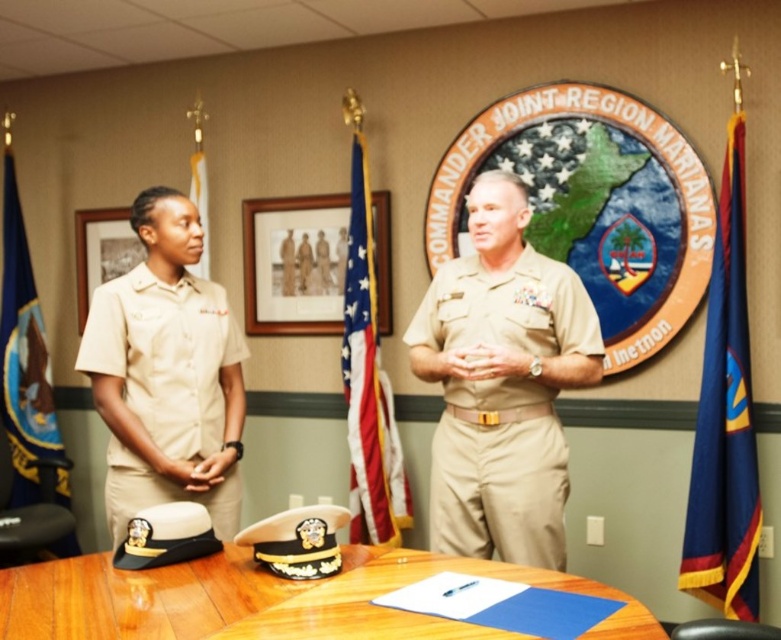
Question: Considering the relative positions of wooden table at center and blue fabric flag at upper left in the image provided, where is wooden table at center located with respect to blue fabric flag at upper left?

Choices:
 (A) right
 (B) left

Answer: (A)

Question: Can you confirm if blue fabric flag at left is positioned to the left of blue fabric flag at upper left?

Choices:
 (A) yes
 (B) no

Answer: (A)

Question: Can you confirm if beige fabric uniform at left is positioned above blue fabric flag at right?

Choices:
 (A) no
 (B) yes

Answer: (A)

Question: Which point is farther to the camera?

Choices:
 (A) blue fabric flag at left
 (B) beige fabric uniform at left

Answer: (A)

Question: Which object is positioned farthest from the blue fabric flag at right?

Choices:
 (A) blue fabric flag at left
 (B) wooden table at center
 (C) tan fabric uniform at center
 (D) beige fabric uniform at left

Answer: (A)

Question: Which point appears closest to the camera in this image?

Choices:
 (A) (143, 579)
 (B) (205, 253)

Answer: (A)